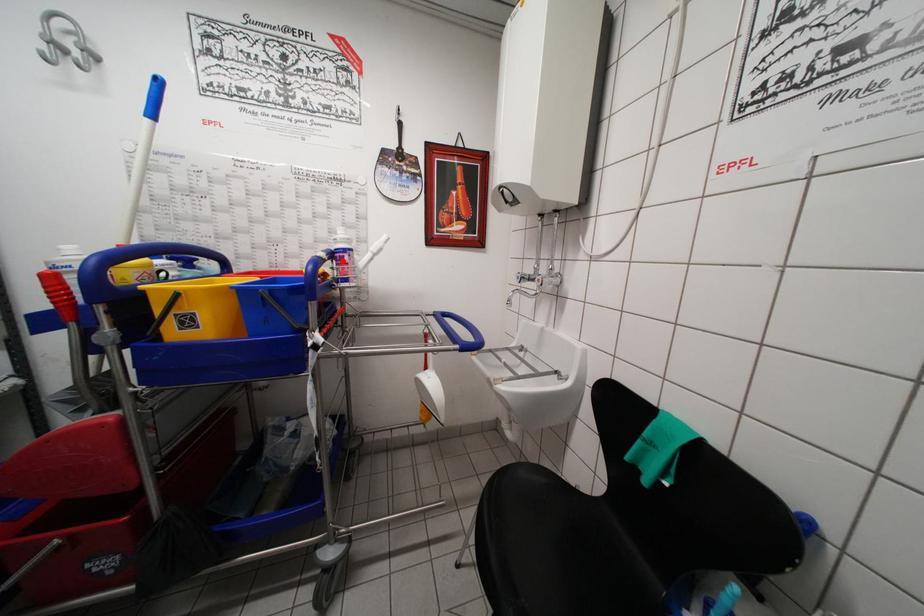
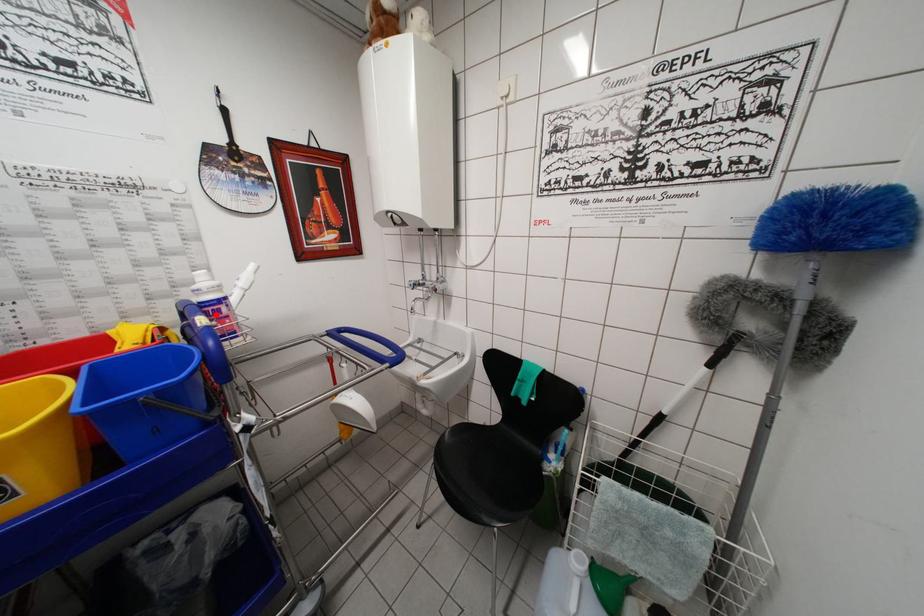
I am providing you with two images of the same scene from different viewpoints. A red point is marked on the first image and another point is marked on the second image. Is the red point in image1 aligned with the point shown in image2?

Yes